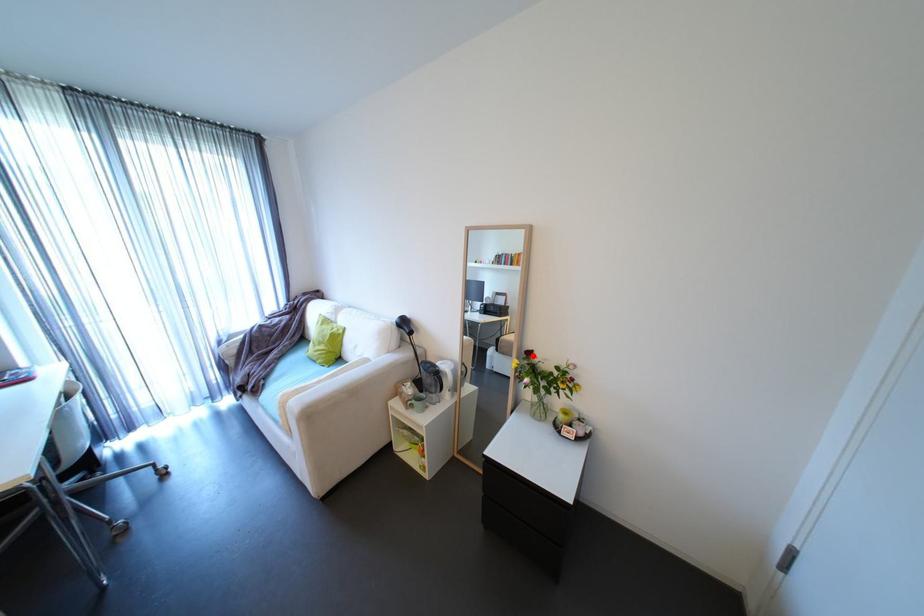
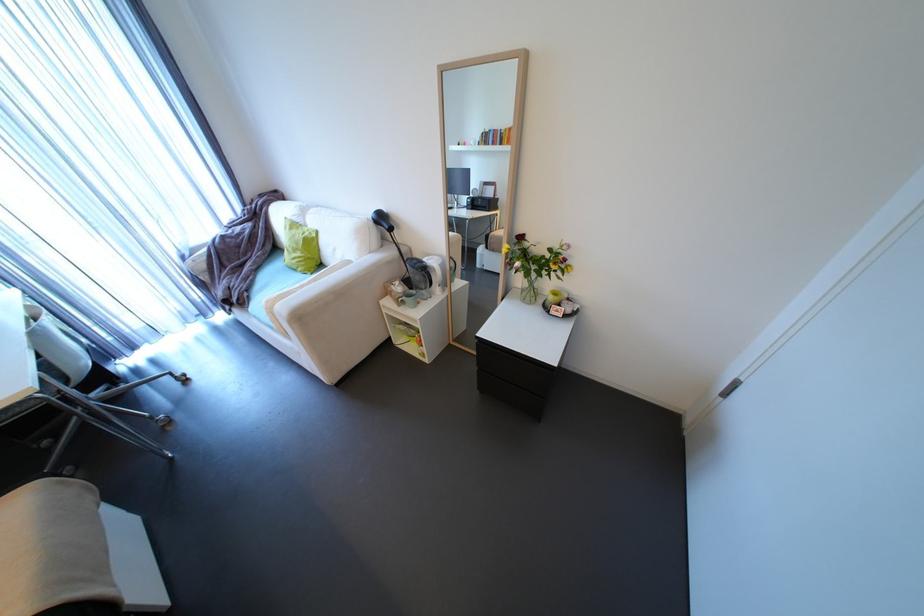
Find the pixel in the second image that matches the highlighted location in the first image.

(524, 241)